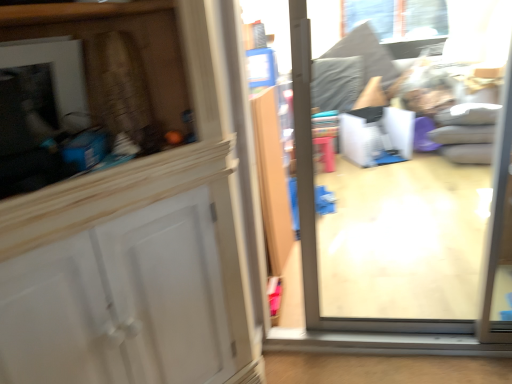
Question: Can you confirm if clear glass window at upper center is thinner than transparent glass door at center?

Choices:
 (A) no
 (B) yes

Answer: (B)

Question: From a real-world perspective, is clear glass window at upper center over transparent glass door at center?

Choices:
 (A) no
 (B) yes

Answer: (B)

Question: Is clear glass window at upper center in front of transparent glass door at center?

Choices:
 (A) yes
 (B) no

Answer: (B)

Question: Can you confirm if clear glass window at upper center is bigger than transparent glass door at center?

Choices:
 (A) yes
 (B) no

Answer: (B)

Question: Is clear glass window at upper center positioned beyond the bounds of transparent glass door at center?

Choices:
 (A) yes
 (B) no

Answer: (A)

Question: Does clear glass window at upper center have a lesser height compared to transparent glass door at center?

Choices:
 (A) yes
 (B) no

Answer: (A)

Question: Is transparent glass door at center shorter than clear glass window at upper center?

Choices:
 (A) no
 (B) yes

Answer: (A)

Question: From the image's perspective, does transparent glass door at center appear lower than clear glass window at upper center?

Choices:
 (A) no
 (B) yes

Answer: (B)

Question: Can you confirm if transparent glass door at center is positioned to the right of clear glass window at upper center?

Choices:
 (A) no
 (B) yes

Answer: (A)

Question: Considering the relative sizes of transparent glass door at center and clear glass window at upper center in the image provided, is transparent glass door at center wider than clear glass window at upper center?

Choices:
 (A) yes
 (B) no

Answer: (A)

Question: Is transparent glass door at center far away from clear glass window at upper center?

Choices:
 (A) yes
 (B) no

Answer: (A)

Question: From a real-world perspective, is transparent glass door at center beneath clear glass window at upper center?

Choices:
 (A) yes
 (B) no

Answer: (A)

Question: From the image's perspective, is transparent glass door at center located above or below clear glass window at upper center?

Choices:
 (A) below
 (B) above

Answer: (A)